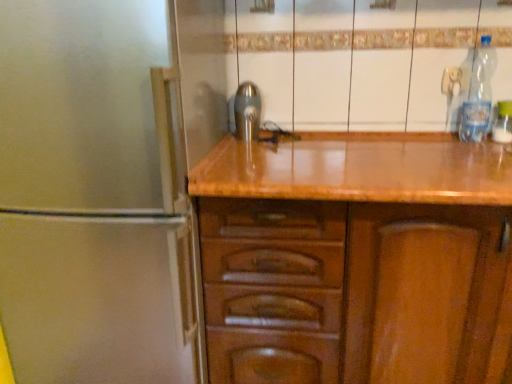
The height and width of the screenshot is (384, 512). In order to click on clear plastic bottle at right, which is counted as the 1th bottle, starting from the right in this screenshot , I will do `click(503, 123)`.

Locate an element on the screen. The image size is (512, 384). clear plastic bottle at right, which is counted as the 1th bottle, starting from the right is located at coordinates (503, 123).

From a real-world perspective, is polished metallic tap at center above or below clear plastic bottle at upper right, which ranks as the 1th bottle in left-to-right order?

In terms of real-world spatial position, polished metallic tap at center is below clear plastic bottle at upper right, which ranks as the 1th bottle in left-to-right order.

Is polished metallic tap at center oriented towards clear plastic bottle at upper right, which ranks as the 1th bottle in left-to-right order?

No, polished metallic tap at center is not facing towards clear plastic bottle at upper right, which ranks as the 1th bottle in left-to-right order.

Is polished metallic tap at center next to clear plastic bottle at upper right, which ranks as the 1th bottle in left-to-right order?

No, polished metallic tap at center is not making contact with clear plastic bottle at upper right, which ranks as the 1th bottle in left-to-right order.

Considering the sizes of objects polished metallic tap at center and clear plastic bottle at upper right, the second bottle from the right, in the image provided, who is shorter, polished metallic tap at center or clear plastic bottle at upper right, the second bottle from the right,?

polished metallic tap at center is shorter.

Where is `tap above the clear plastic bottle at right, the 2th bottle positioned from the left (from the image's perspective)`? tap above the clear plastic bottle at right, the 2th bottle positioned from the left (from the image's perspective) is located at coordinates (247, 111).

Can you confirm if clear plastic bottle at right, which is counted as the 1th bottle, starting from the right, is thinner than polished metallic tap at center?

Yes.

Is clear plastic bottle at right, which is counted as the 1th bottle, starting from the right, positioned with its back to polished metallic tap at center?

No, clear plastic bottle at right, which is counted as the 1th bottle, starting from the right, is not facing away from polished metallic tap at center.

Can you confirm if clear plastic bottle at right, which is counted as the 1th bottle, starting from the right, is smaller than polished metallic tap at center?

Indeed, clear plastic bottle at right, which is counted as the 1th bottle, starting from the right, has a smaller size compared to polished metallic tap at center.

Which is behind, point (236, 115) or point (502, 102)?

The point (236, 115) is farther from the camera.

Is polished metallic tap at center outside of clear plastic bottle at right, which is counted as the 1th bottle, starting from the right?

polished metallic tap at center lies outside clear plastic bottle at right, which is counted as the 1th bottle, starting from the right,'s area.

From the image's perspective, which is below, polished metallic tap at center or clear plastic bottle at right, the 2th bottle positioned from the left?

clear plastic bottle at right, the 2th bottle positioned from the left, is shown below in the image.

Between polished metallic tap at center and clear plastic bottle at right, the 2th bottle positioned from the left, which one has smaller width?

Thinner between the two is clear plastic bottle at right, the 2th bottle positioned from the left.

Considering the relative sizes of clear plastic bottle at upper right, which ranks as the 1th bottle in left-to-right order, and clear plastic bottle at right, which is counted as the 1th bottle, starting from the right, in the image provided, is clear plastic bottle at upper right, which ranks as the 1th bottle in left-to-right order, wider than clear plastic bottle at right, which is counted as the 1th bottle, starting from the right,?

Indeed, clear plastic bottle at upper right, which ranks as the 1th bottle in left-to-right order, has a greater width compared to clear plastic bottle at right, which is counted as the 1th bottle, starting from the right.

Based on the photo, does clear plastic bottle at upper right, which ranks as the 1th bottle in left-to-right order, have a greater height compared to clear plastic bottle at right, which is counted as the 1th bottle, starting from the right?

Indeed, clear plastic bottle at upper right, which ranks as the 1th bottle in left-to-right order, has a greater height compared to clear plastic bottle at right, which is counted as the 1th bottle, starting from the right.

Choose the correct answer: Is clear plastic bottle at upper right, which ranks as the 1th bottle in left-to-right order, inside clear plastic bottle at right, the 2th bottle positioned from the left, or outside it?

clear plastic bottle at upper right, which ranks as the 1th bottle in left-to-right order, is located beyond the bounds of clear plastic bottle at right, the 2th bottle positioned from the left.

Is clear plastic bottle at upper right, which ranks as the 1th bottle in left-to-right order, to the left of clear plastic bottle at right, the 2th bottle positioned from the left, from the viewer's perspective?

Yes, clear plastic bottle at upper right, which ranks as the 1th bottle in left-to-right order, is to the left of clear plastic bottle at right, the 2th bottle positioned from the left.

Who is bigger, clear plastic bottle at upper right, the second bottle from the right, or polished metallic tap at center?

With larger size is clear plastic bottle at upper right, the second bottle from the right.

Consider the image. From the image's perspective, between clear plastic bottle at upper right, which ranks as the 1th bottle in left-to-right order, and polished metallic tap at center, who is located below?

polished metallic tap at center appears lower in the image.

Can polished metallic tap at center be found inside clear plastic bottle at upper right, which ranks as the 1th bottle in left-to-right order?

Actually, polished metallic tap at center is outside clear plastic bottle at upper right, which ranks as the 1th bottle in left-to-right order.

Does clear plastic bottle at upper right, the second bottle from the right, appear on the right side of polished metallic tap at center?

Yes, clear plastic bottle at upper right, the second bottle from the right, is to the right of polished metallic tap at center.

Which point is more forward, [506,101] or [473,117]?

The point [506,101] is closer.

Which object is further away from the camera taking this photo, clear plastic bottle at right, the 2th bottle positioned from the left, or clear plastic bottle at upper right, the second bottle from the right?

clear plastic bottle at right, the 2th bottle positioned from the left, is more distant.

Between clear plastic bottle at right, which is counted as the 1th bottle, starting from the right, and clear plastic bottle at upper right, which ranks as the 1th bottle in left-to-right order, which one has smaller size?

clear plastic bottle at right, which is counted as the 1th bottle, starting from the right.

Locate an element on the screen. The height and width of the screenshot is (384, 512). tap that appears below the clear plastic bottle at upper right, the second bottle from the right (from the image's perspective) is located at coordinates (247, 111).

The image size is (512, 384). I want to click on tap above the clear plastic bottle at right, which is counted as the 1th bottle, starting from the right (from a real-world perspective), so click(x=247, y=111).

When comparing their distances from clear plastic bottle at upper right, which ranks as the 1th bottle in left-to-right order, does polished metallic tap at center or clear plastic bottle at right, which is counted as the 1th bottle, starting from the right, seem closer?

clear plastic bottle at right, which is counted as the 1th bottle, starting from the right, is positioned closer to the anchor clear plastic bottle at upper right, which ranks as the 1th bottle in left-to-right order.

Estimate the real-world distances between objects in this image. Which object is further from clear plastic bottle at right, which is counted as the 1th bottle, starting from the right, clear plastic bottle at upper right, which ranks as the 1th bottle in left-to-right order, or polished metallic tap at center?

polished metallic tap at center is positioned further to the anchor clear plastic bottle at right, which is counted as the 1th bottle, starting from the right.

Looking at the image, which one is located further to polished metallic tap at center, clear plastic bottle at upper right, which ranks as the 1th bottle in left-to-right order, or clear plastic bottle at right, the 2th bottle positioned from the left?

clear plastic bottle at right, the 2th bottle positioned from the left, is further to polished metallic tap at center.

Considering their positions, is clear plastic bottle at right, the 2th bottle positioned from the left, positioned closer to polished metallic tap at center than clear plastic bottle at upper right, which ranks as the 1th bottle in left-to-right order?

clear plastic bottle at upper right, which ranks as the 1th bottle in left-to-right order, is closer to polished metallic tap at center.

Estimate the real-world distances between objects in this image. Which object is closer to clear plastic bottle at upper right, which ranks as the 1th bottle in left-to-right order, clear plastic bottle at right, the 2th bottle positioned from the left, or polished metallic tap at center?

clear plastic bottle at right, the 2th bottle positioned from the left.

Looking at the image, which one is located further to clear plastic bottle at right, the 2th bottle positioned from the left, polished metallic tap at center or clear plastic bottle at upper right, which ranks as the 1th bottle in left-to-right order?

polished metallic tap at center is positioned further to the anchor clear plastic bottle at right, the 2th bottle positioned from the left.

The image size is (512, 384). I want to click on bottle located between polished metallic tap at center and clear plastic bottle at right, which is counted as the 1th bottle, starting from the right, in the left-right direction, so click(x=478, y=96).